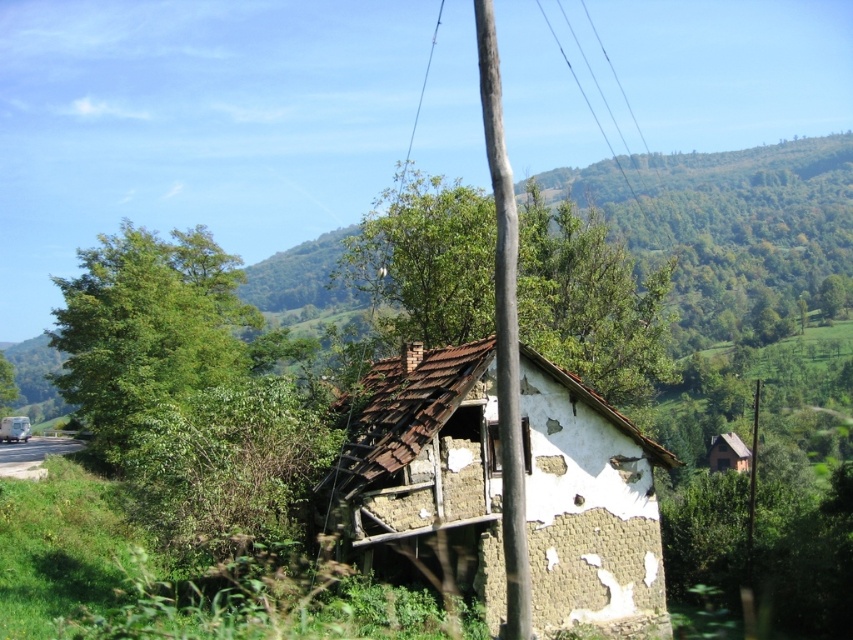
Question: Can you confirm if rusty clay hut at center is wider than green leafy tree at center?

Choices:
 (A) yes
 (B) no

Answer: (B)

Question: Is rusty clay hut at center smaller than green leafy tree at left?

Choices:
 (A) no
 (B) yes

Answer: (B)

Question: Which of the following is the farthest from the observer?

Choices:
 (A) (358, 509)
 (B) (144, 326)
 (C) (744, 454)
 (D) (497, 202)

Answer: (C)

Question: Can you confirm if green leafy tree at center is bigger than wooden thatched hut at lower right?

Choices:
 (A) no
 (B) yes

Answer: (B)

Question: Considering the real-world distances, which object is closest to the green leafy tree at left?

Choices:
 (A) rusty clay hut at center
 (B) green leafy tree at center

Answer: (B)

Question: Which point is farther to the camera?

Choices:
 (A) brown wooden telegraph pole at center
 (B) wooden thatched hut at lower right
 (C) smooth wire at upper center

Answer: (C)